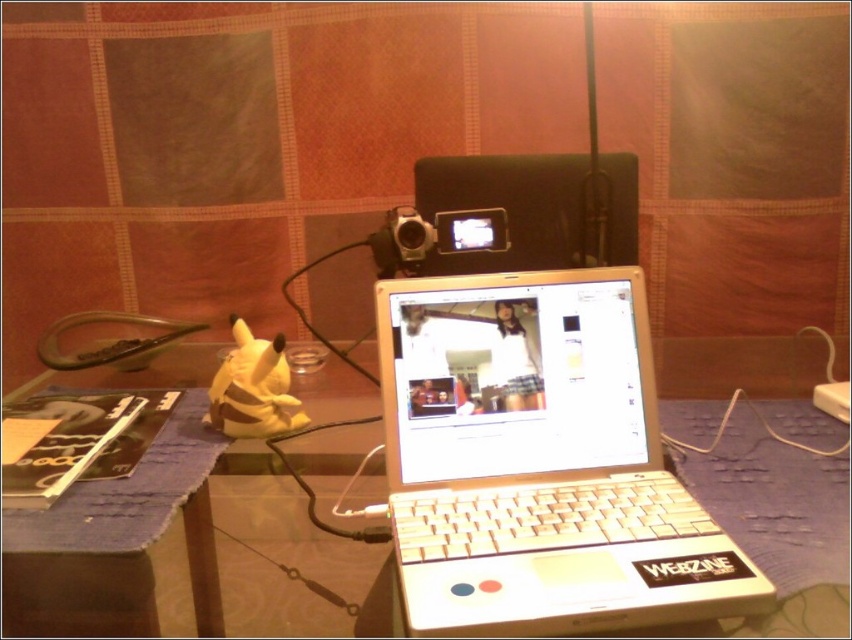
Question: Does white plastic laptop at center appear on the right side of black matte speaker at upper center?

Choices:
 (A) no
 (B) yes

Answer: (A)

Question: From the image, what is the correct spatial relationship of black matte speaker at upper center in relation to sleek black video camera at center?

Choices:
 (A) below
 (B) above

Answer: (B)

Question: Does black matte speaker at upper center appear on the left side of sleek black video camera at center?

Choices:
 (A) yes
 (B) no

Answer: (B)

Question: Considering the real-world distances, which object is closest to the black matte speaker at upper center?

Choices:
 (A) white plastic laptop at center
 (B) blue fabric table at center

Answer: (A)

Question: Estimate the real-world distances between objects in this image. Which object is closer to the white plastic laptop at center?

Choices:
 (A) blue fabric table at center
 (B) black matte speaker at upper center
 (C) sleek black video camera at center

Answer: (A)

Question: Based on their relative distances, which object is farther from the blue fabric table at center?

Choices:
 (A) white plastic laptop at center
 (B) black matte speaker at upper center
 (C) sleek black video camera at center

Answer: (B)